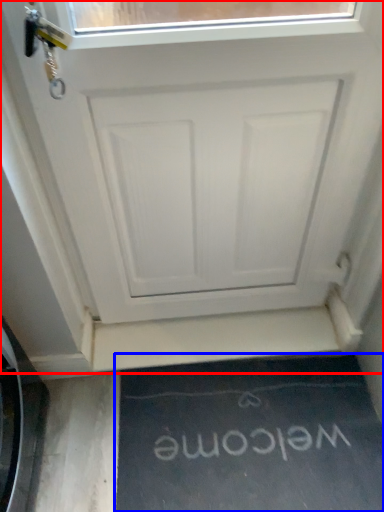
Question: Which of the following is the closest to the observer, door (highlighted by a red box) or doormat (highlighted by a blue box)?

Choices:
 (A) door
 (B) doormat

Answer: (A)